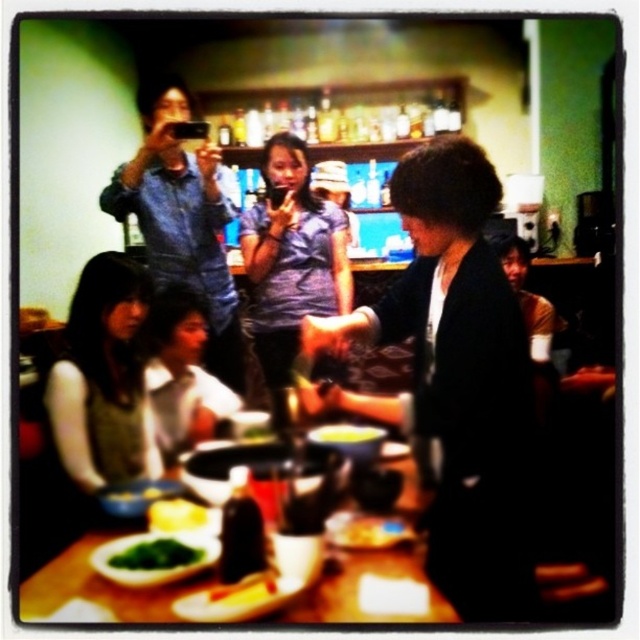
Question: Estimate the real-world distances between objects in this image. Which object is closer to the matte gray vest at lower left?

Choices:
 (A) yellow cheese at center
 (B) black matte shirt at center
 (C) green leafy vegetable at table center
 (D) green matte plate at center

Answer: (C)

Question: Does white fabric shirt at lower left have a greater width compared to green leafy vegetable at table center?

Choices:
 (A) no
 (B) yes

Answer: (B)

Question: Where is white fabric shirt at lower left located in relation to yellow cheese at center in the image?

Choices:
 (A) right
 (B) left

Answer: (B)

Question: Which object is closer to the camera taking this photo?

Choices:
 (A) green matte plate at center
 (B) yellow matte rice at lower left
 (C) denim shirt at upper left
 (D) yellow matte plate at center

Answer: (A)

Question: Which point is closer to the camera taking this photo?

Choices:
 (A) (353, 435)
 (B) (486, 556)

Answer: (B)

Question: Can you confirm if yellow matte bowl at center is positioned above yellow cheese at center?

Choices:
 (A) yes
 (B) no

Answer: (A)